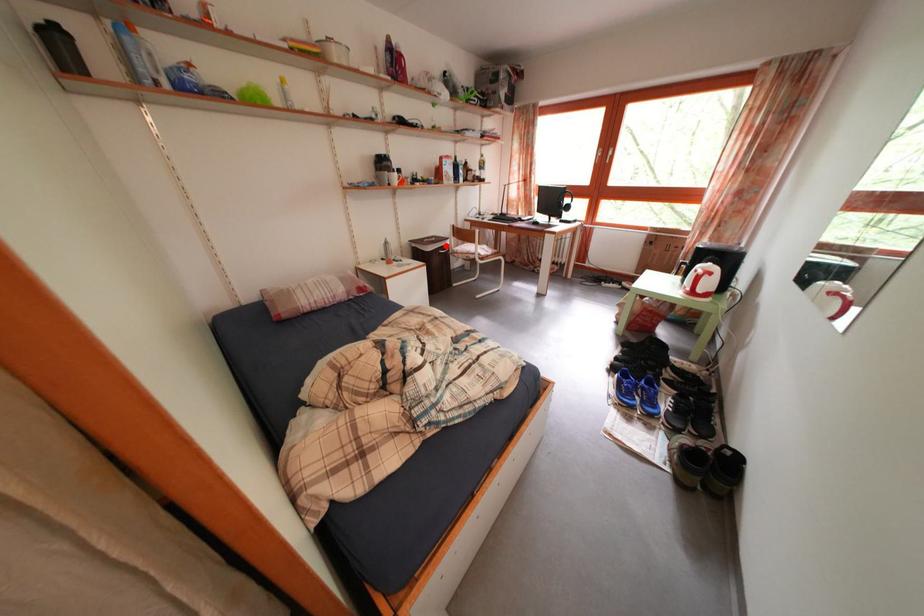
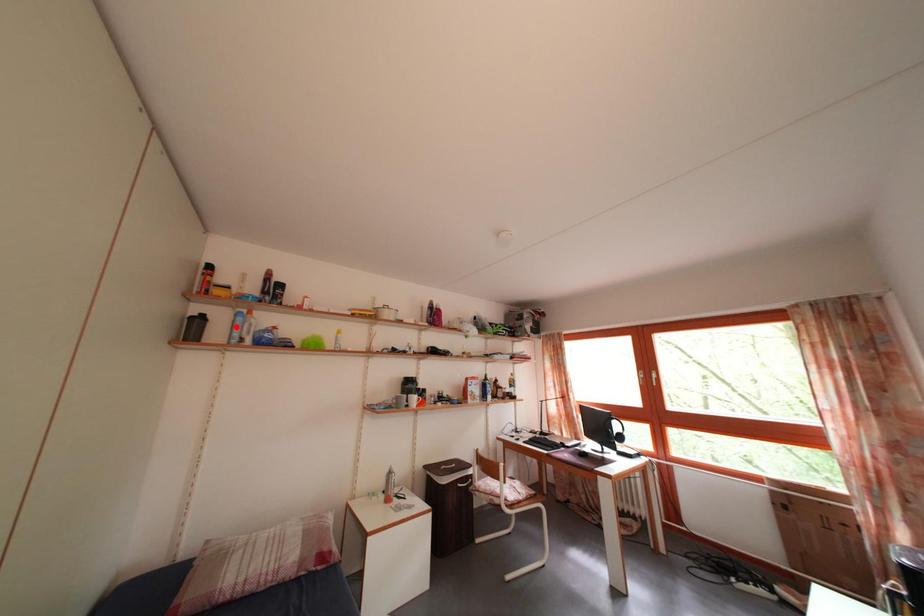
I am providing you with two images of the same scene from different viewpoints. A red point is marked on the first image and another point is marked on the second image. Are the points marked in image1 and image2 representing the same 3D position?

No